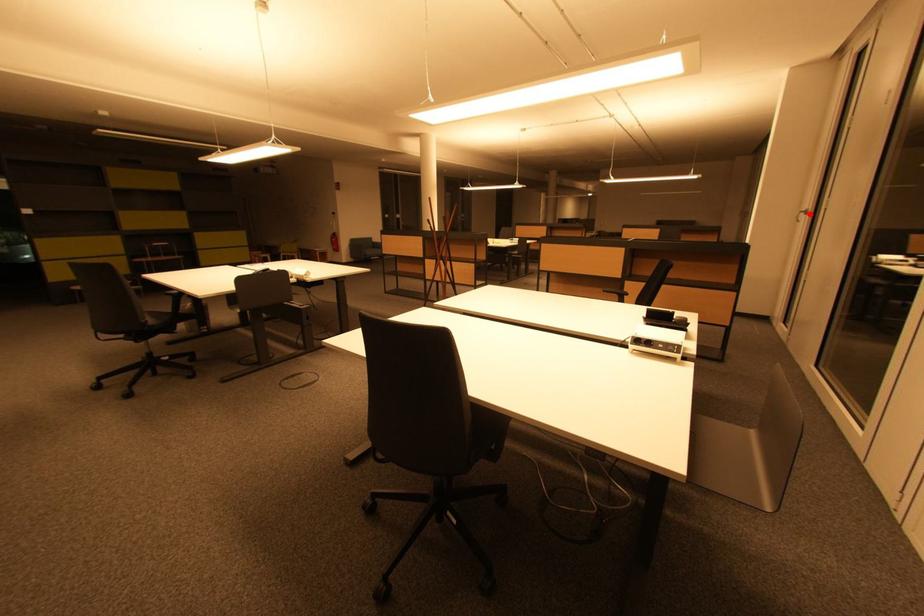
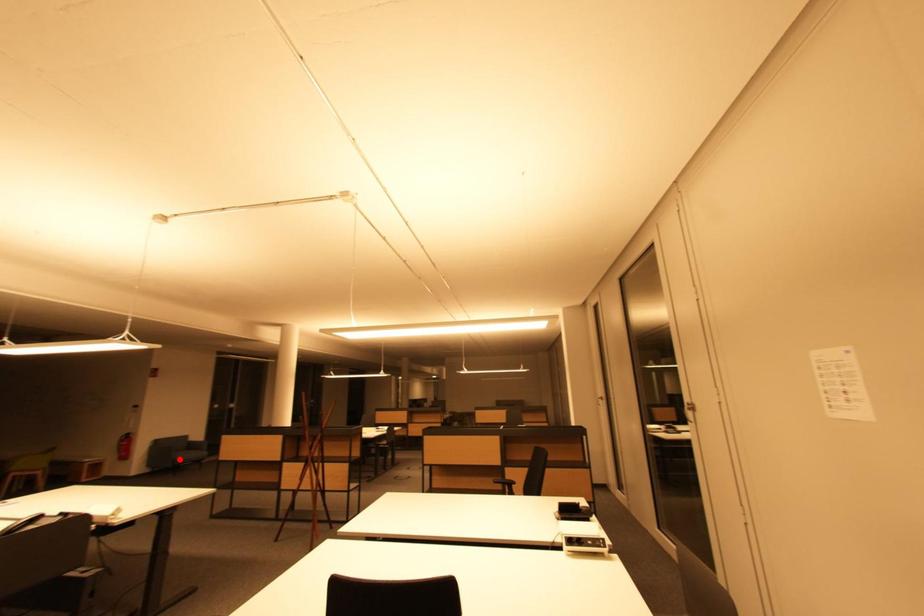
From the picture: I am providing you with two images of the same scene from different viewpoints. A red point is marked on the first image and another point is marked on the second image. Is the marked point in image1 the same physical position as the marked point in image2?

No